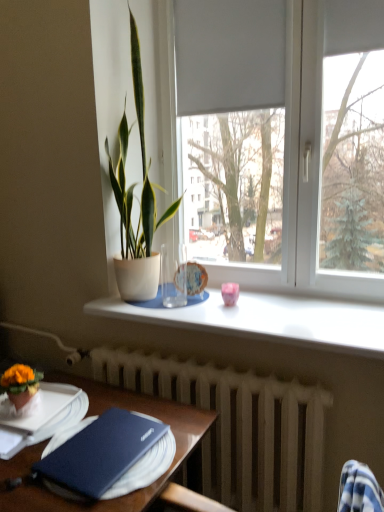
Locate an element on the screen. The height and width of the screenshot is (512, 384). vacant space in front of porcelain plate at center, arranged as the second tableware when viewed from the right is located at coordinates (190, 304).